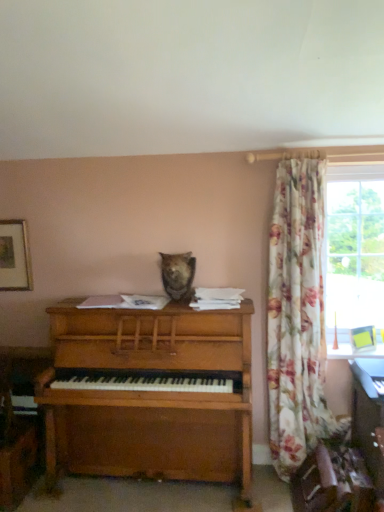
Question: Can you confirm if fuzzy brown bear at center is smaller than wooden piano at center?

Choices:
 (A) no
 (B) yes

Answer: (B)

Question: From the image's perspective, is fuzzy brown bear at center located above wooden piano at center?

Choices:
 (A) no
 (B) yes

Answer: (B)

Question: Does fuzzy brown bear at center lie behind wooden piano at center?

Choices:
 (A) yes
 (B) no

Answer: (A)

Question: From a real-world perspective, is fuzzy brown bear at center over wooden piano at center?

Choices:
 (A) no
 (B) yes

Answer: (B)

Question: Is fuzzy brown bear at center facing towards wooden piano at center?

Choices:
 (A) yes
 (B) no

Answer: (B)

Question: Would you say fuzzy brown bear at center is a long distance from wooden piano at center?

Choices:
 (A) yes
 (B) no

Answer: (B)

Question: Is wooden piano at center positioned in front of wooden desk at lower right?

Choices:
 (A) no
 (B) yes

Answer: (A)

Question: Can you confirm if wooden piano at center is wider than wooden desk at lower right?

Choices:
 (A) no
 (B) yes

Answer: (B)

Question: From the image's perspective, is wooden piano at center beneath wooden desk at lower right?

Choices:
 (A) yes
 (B) no

Answer: (B)

Question: From a real-world perspective, is wooden piano at center located higher than wooden desk at lower right?

Choices:
 (A) yes
 (B) no

Answer: (A)

Question: Is wooden piano at center bigger than wooden desk at lower right?

Choices:
 (A) yes
 (B) no

Answer: (A)

Question: Could you tell me if wooden piano at center is facing wooden desk at lower right?

Choices:
 (A) no
 (B) yes

Answer: (A)

Question: Is fuzzy brown bear at center bigger than wooden desk at lower right?

Choices:
 (A) yes
 (B) no

Answer: (A)